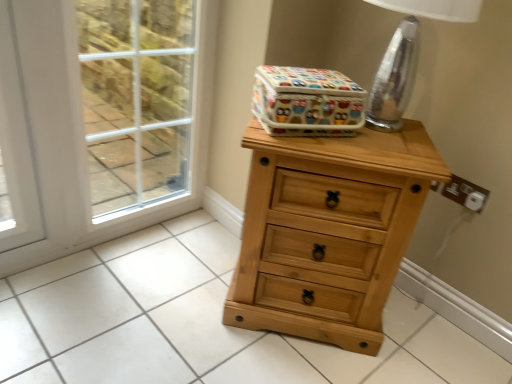
Question: Is the depth of white plastic electric outlet at right greater than that of clear glass table lamp at upper right?

Choices:
 (A) yes
 (B) no

Answer: (A)

Question: Is clear glass table lamp at upper right located within white plastic electric outlet at right?

Choices:
 (A) no
 (B) yes

Answer: (A)

Question: Is white plastic electric outlet at right positioned with its back to clear glass table lamp at upper right?

Choices:
 (A) yes
 (B) no

Answer: (B)

Question: Would you say white plastic electric outlet at right is outside clear glass table lamp at upper right?

Choices:
 (A) yes
 (B) no

Answer: (A)

Question: From a real-world perspective, is white plastic electric outlet at right positioned under clear glass table lamp at upper right based on gravity?

Choices:
 (A) no
 (B) yes

Answer: (B)

Question: Do you think clear glass table lamp at upper right is within natural wood chest of drawers at center, or outside of it?

Choices:
 (A) inside
 (B) outside

Answer: (B)

Question: Does point (418, 48) appear closer or farther from the camera than point (313, 269)?

Choices:
 (A) closer
 (B) farther

Answer: (B)

Question: Looking at their shapes, would you say clear glass table lamp at upper right is wider or thinner than natural wood chest of drawers at center?

Choices:
 (A) wide
 (B) thin

Answer: (B)

Question: From the image's perspective, relative to natural wood chest of drawers at center, is clear glass table lamp at upper right above or below?

Choices:
 (A) below
 (B) above

Answer: (B)

Question: Is point (303, 117) closer or farther from the camera than point (484, 201)?

Choices:
 (A) closer
 (B) farther

Answer: (A)

Question: Is colorful fabric storage box at upper center taller or shorter than white plastic electric outlet at right?

Choices:
 (A) short
 (B) tall

Answer: (B)

Question: Looking at their shapes, would you say colorful fabric storage box at upper center is wider or thinner than white plastic electric outlet at right?

Choices:
 (A) thin
 (B) wide

Answer: (B)

Question: Considering their positions, is colorful fabric storage box at upper center located in front of or behind white plastic electric outlet at right?

Choices:
 (A) front
 (B) behind

Answer: (A)

Question: Is natural wood chest of drawers at center situated inside white plastic electric outlet at right or outside?

Choices:
 (A) inside
 (B) outside

Answer: (B)

Question: Is point (362, 129) positioned closer to the camera than point (471, 198)?

Choices:
 (A) farther
 (B) closer

Answer: (B)